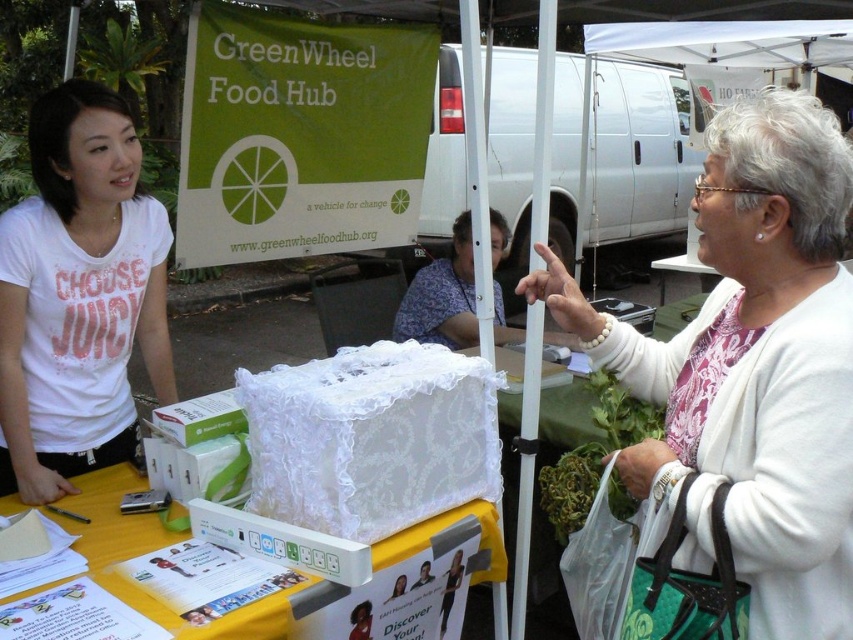
Question: Which of these objects is positioned farthest from the yellow fabric table at center?

Choices:
 (A) white t-shirt at upper left
 (B) white lace box at center

Answer: (B)

Question: Which object is the farthest from the yellow fabric table at center?

Choices:
 (A) white lace box at center
 (B) white t-shirt at upper left

Answer: (A)

Question: Is white lace box at center above floral fabric bag at center?

Choices:
 (A) yes
 (B) no

Answer: (B)

Question: Which object is the farthest from the floral fabric bag at center?

Choices:
 (A) white t-shirt at upper left
 (B) yellow fabric table at center
 (C) white lace box at center

Answer: (B)

Question: Where is white lace box at center located in relation to white t-shirt at upper left in the image?

Choices:
 (A) left
 (B) right

Answer: (B)

Question: Can you confirm if white lace box at center is positioned to the left of floral fabric bag at center?

Choices:
 (A) no
 (B) yes

Answer: (A)